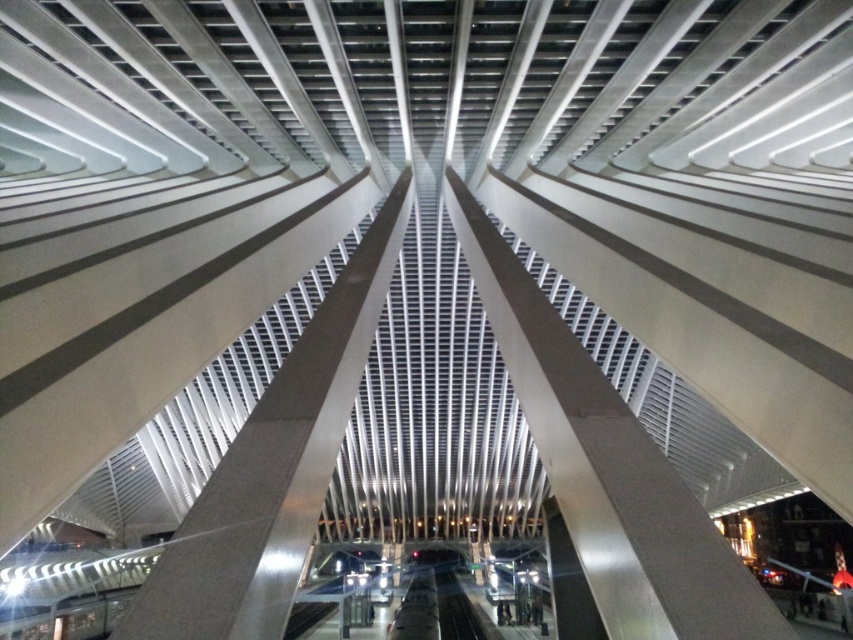
Question: Which point is closer to the camera taking this photo?

Choices:
 (A) (679, 481)
 (B) (253, 534)

Answer: (B)

Question: Can you confirm if metallic silver beam at center is positioned to the right of satin silver beam at center?

Choices:
 (A) no
 (B) yes

Answer: (B)

Question: Is metallic silver beam at center below satin silver beam at center?

Choices:
 (A) no
 (B) yes

Answer: (B)

Question: Which point is farther to the camera?

Choices:
 (A) (190, 605)
 (B) (692, 600)

Answer: (A)

Question: Is metallic silver beam at center bigger than satin silver beam at center?

Choices:
 (A) yes
 (B) no

Answer: (A)